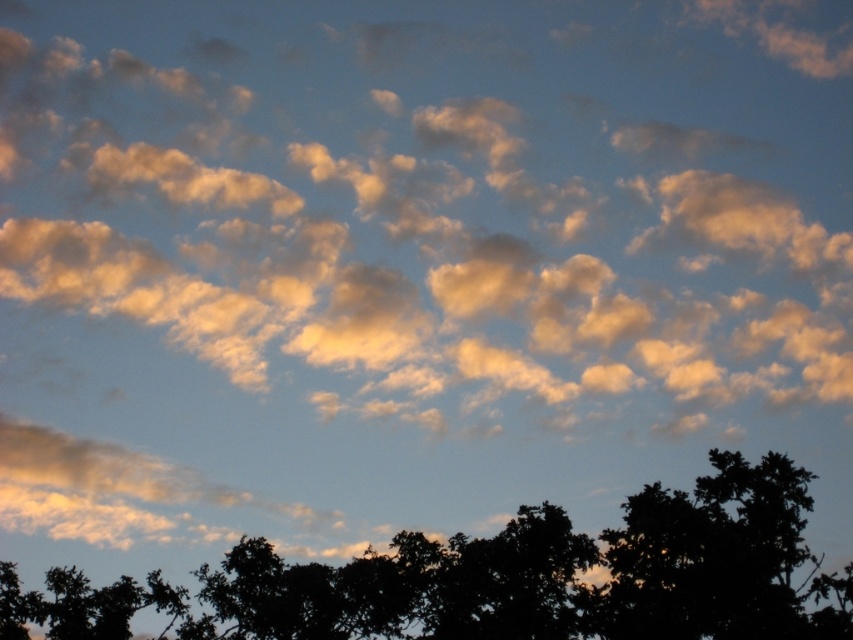
Question: Considering the relative positions of golden fluffy cloud at upper center and silhouette leafy tree at lower center in the image provided, where is golden fluffy cloud at upper center located with respect to silhouette leafy tree at lower center?

Choices:
 (A) below
 (B) above

Answer: (B)

Question: Can you confirm if golden fluffy cloud at upper center is positioned to the left of silhouette leafy tree at lower center?

Choices:
 (A) yes
 (B) no

Answer: (B)

Question: Observing the image, what is the correct spatial positioning of golden fluffy cloud at upper center in reference to silhouette leafy tree at lower center?

Choices:
 (A) right
 (B) left

Answer: (A)